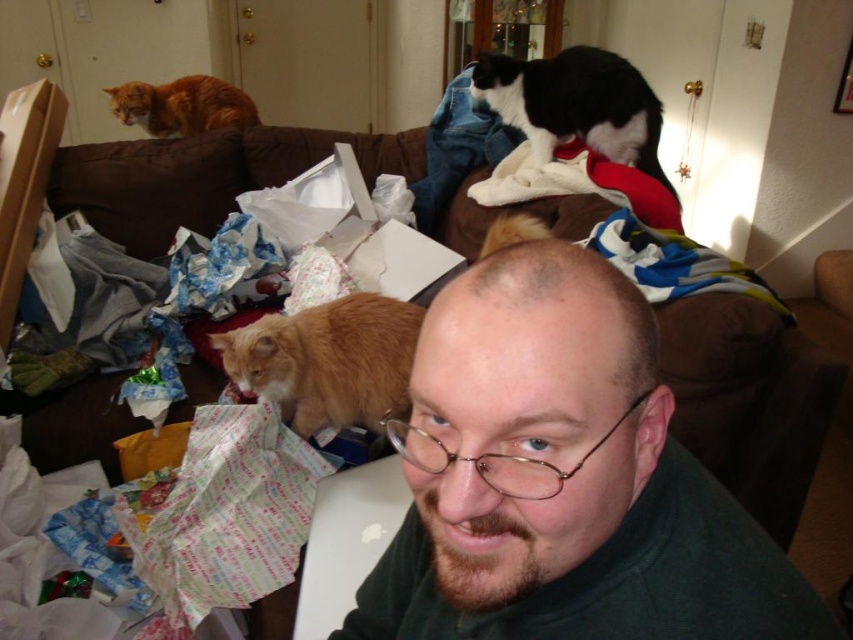
You are a photographer taking a picture of the living room scene. You need to focus on two specific points in the image, point 1 at [601,147] and point 2 at [119,90]. Which point should you focus on first to ensure the closest object is sharp?

Point 1 at [601,147] is closer to the camera than point 2 at [119,90], so you should focus on point 1 first to ensure the closest object is sharp.

Consider the image. You are trying to decide which cat to adopt based on their size. The orange fur cat at lower left and the black and white fur at upper center are both available. According to the image, which cat is taller?

The orange fur cat at lower left is not as tall as black and white fur at upper center, so the black and white fur at upper center is taller.

You are a photographer taking a picture of the green matte shirt at center and the black and white fur at upper center. Which object should you focus on first if you want to capture both in focus?

The black and white fur at upper center should be focused on first because it is higher than the green matte shirt at center, allowing the depth of field to include both when starting from the higher object.